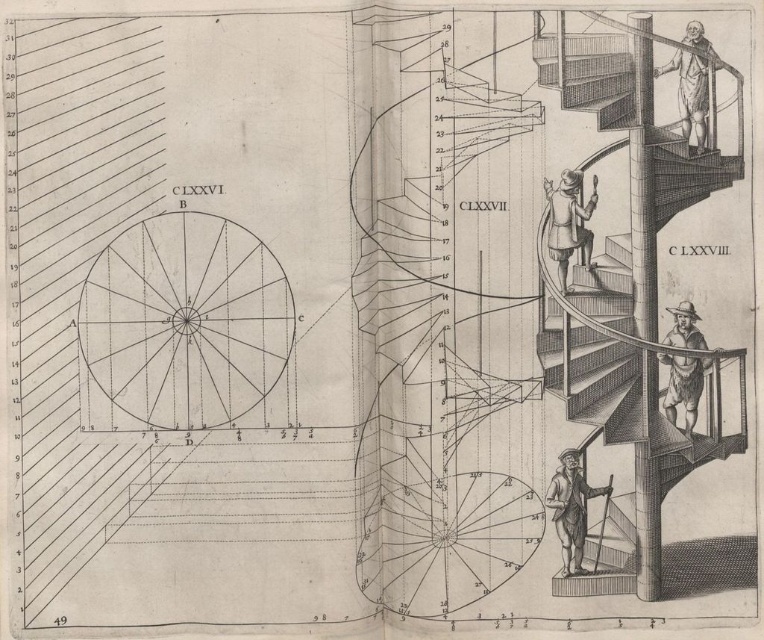
Based on the provided image, what are the coordinates of the wooden staircase at center?

The wooden staircase at center is located at coordinates point [594,342].